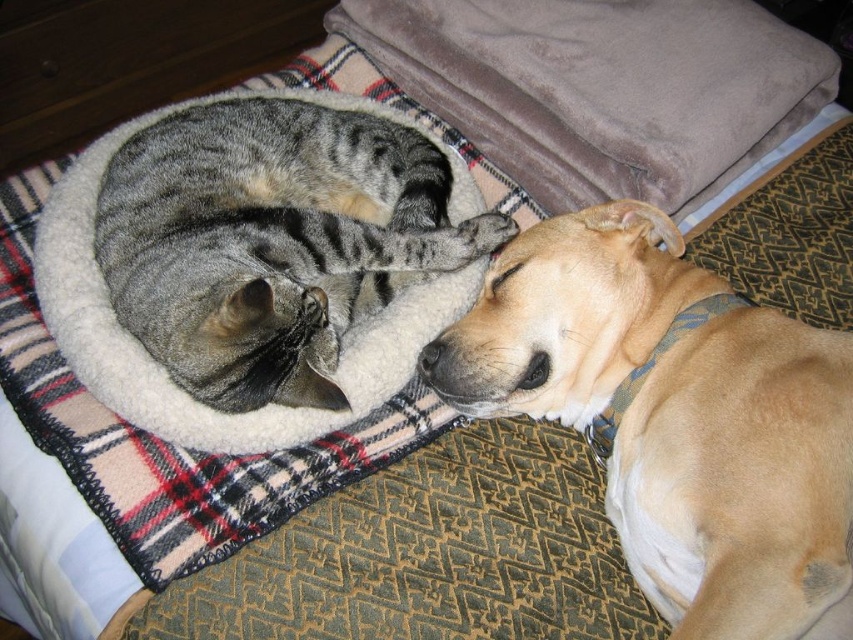
You are a pet owner who wants to ensure your pets are positioned safely on the plaid blanket. Given that the light brown fur at lower right is below the gray striped cat at left, which pet is closer to the edge of the blanket?

The light brown fur at lower right is closer to the edge of the blanket because it is positioned below the gray striped cat at left, meaning it is lower on the blanket and thus nearer to the edge.

You are a pet owner who wants to ensure both pets have enough space in their shared area. Given the light brown fur at lower right and the gray striped cat at left, which pet requires more horizontal space based on their body width?

The gray striped cat at left requires more horizontal space because its width is greater than the light brown fur at lower right.

You are a pet owner who notices two animals in the image. The gray striped cat at left is sleeping, and the light brown fur at lower right is part of another animal. Based on their positions, can you determine which animal is closer to the right edge of the image?

The light brown fur at lower right is to the right of the gray striped cat at left, so the animal with the light brown fur at lower right is closer to the right edge of the image.